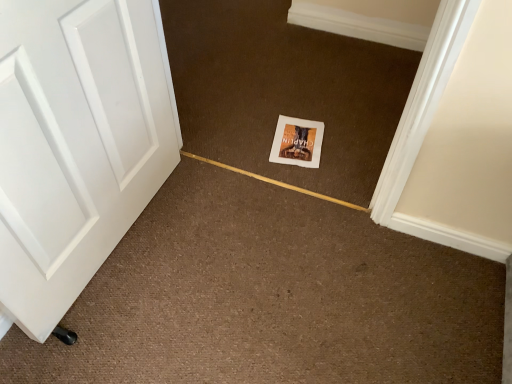
At what (x,y) coordinates should I click in order to perform the action: click on free space behind white paper postcard at center. Please return your answer as a coordinate pair (x, y). The height and width of the screenshot is (384, 512). Looking at the image, I should click on (297, 106).